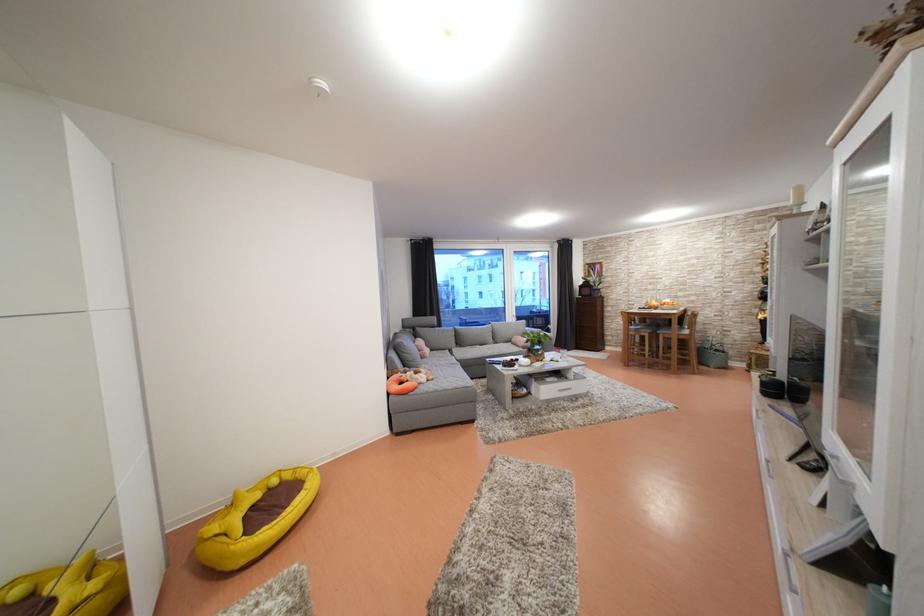
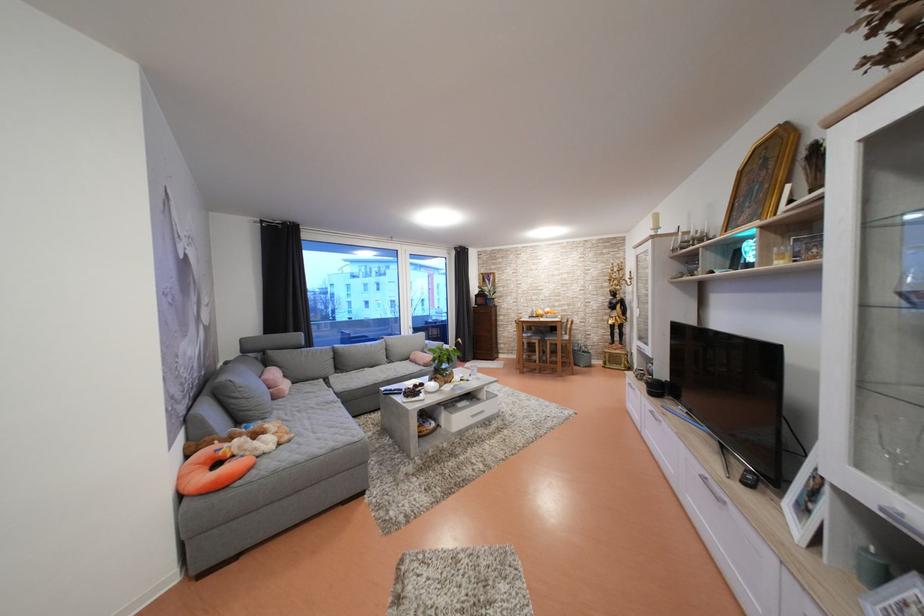
Where in the second image is the point corresponding to (x=808, y=209) from the first image?

(664, 233)